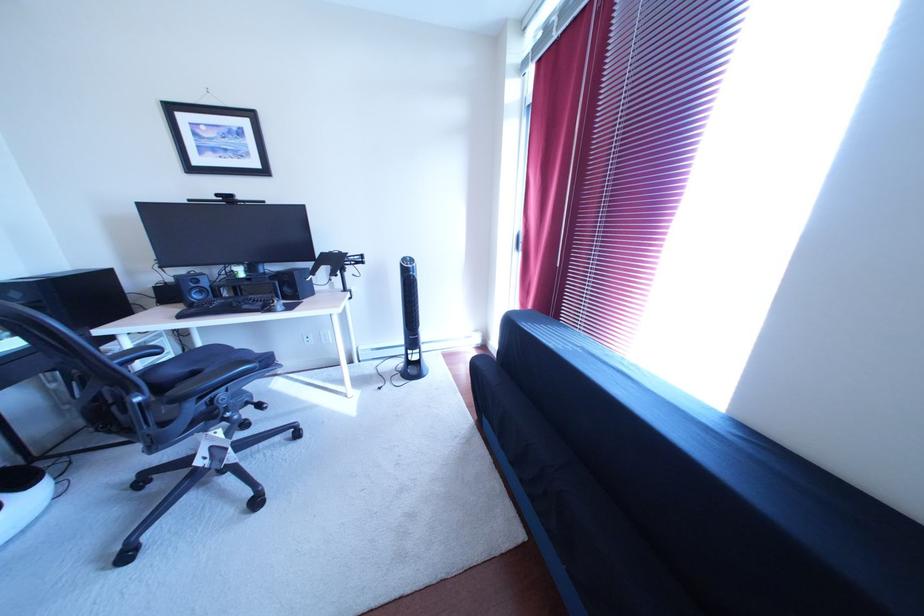
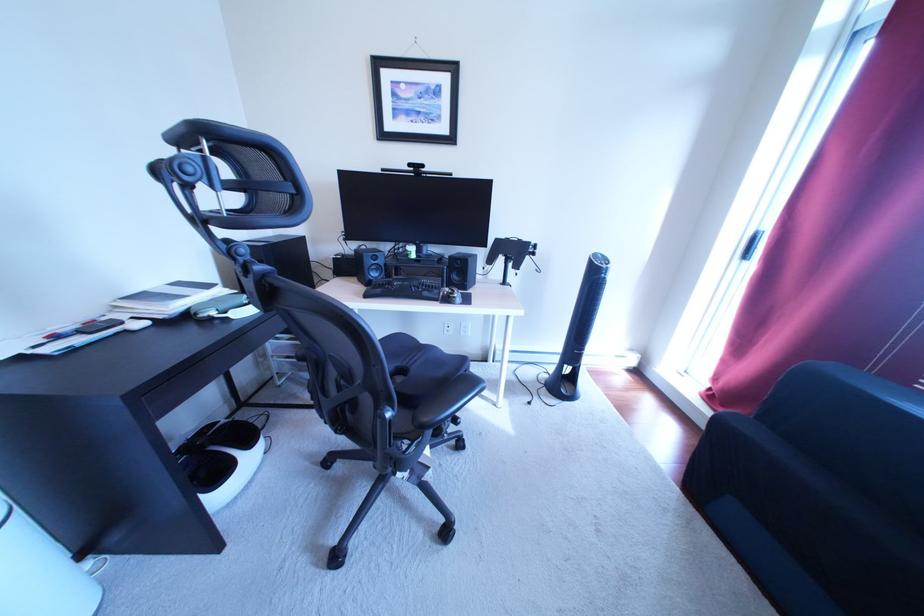
Question: The images are taken continuously from a first-person perspective. In which direction is your viewpoint rotating?

Choices:
 (A) Left
 (B) Right
 (C) Up
 (D) Down

Answer: (A)